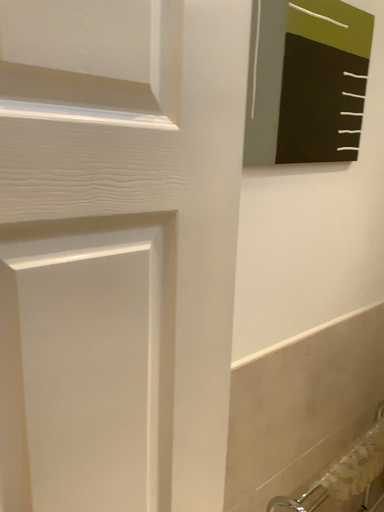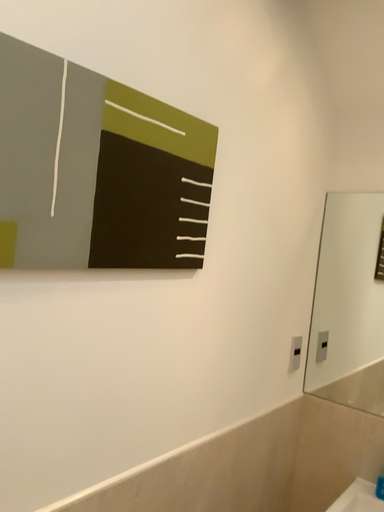
Question: Which way did the camera rotate in the video?

Choices:
 (A) rotated left
 (B) rotated right

Answer: (B)